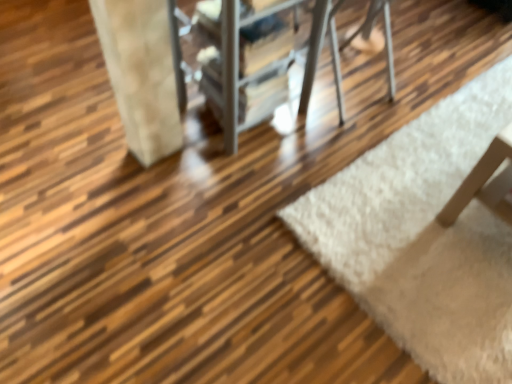
What do you see at coordinates (138, 70) in the screenshot? The width and height of the screenshot is (512, 384). I see `metallic silver chair at center` at bounding box center [138, 70].

This screenshot has width=512, height=384. I want to click on metallic silver chair at center, so click(138, 70).

Measure the distance between point (127, 116) and camera.

Point (127, 116) and camera are 4.72 feet apart.

Image resolution: width=512 pixels, height=384 pixels. I want to click on white fluffy rug at lower right, so click(424, 236).

Describe the element at coordinates (424, 236) in the screenshot. The height and width of the screenshot is (384, 512). I see `white fluffy rug at lower right` at that location.

What is the approximate width of white fluffy rug at lower right?

It is 1.62 meters.

Locate an element on the screen. This screenshot has height=384, width=512. metallic silver chair at center is located at coordinates (138, 70).

Is white fluffy rug at lower right to the right of metallic silver chair at center from the viewer's perspective?

Yes.

Who is more distant, white fluffy rug at lower right or metallic silver chair at center?

white fluffy rug at lower right is behind.

Is point (353, 285) farther from camera compared to point (114, 54)?

Yes, it is.

From the image's perspective, is white fluffy rug at lower right located beneath metallic silver chair at center?

Yes.

From a real-world perspective, who is located lower, white fluffy rug at lower right or metallic silver chair at center?

white fluffy rug at lower right, from a real-world perspective.

Which object is wider, white fluffy rug at lower right or metallic silver chair at center?

white fluffy rug at lower right is wider.

Considering the sizes of objects white fluffy rug at lower right and metallic silver chair at center in the image provided, who is taller, white fluffy rug at lower right or metallic silver chair at center?

With more height is metallic silver chair at center.

From the picture: Considering the sizes of white fluffy rug at lower right and metallic silver chair at center in the image, is white fluffy rug at lower right bigger or smaller than metallic silver chair at center?

Considering their sizes, white fluffy rug at lower right takes up less space than metallic silver chair at center.

Can metallic silver chair at center be found inside white fluffy rug at lower right?

Definitely not — metallic silver chair at center is not inside white fluffy rug at lower right.

Is white fluffy rug at lower right next to metallic silver chair at center and touching it?

No.

Could you tell me if white fluffy rug at lower right is turned towards metallic silver chair at center?

No, white fluffy rug at lower right is not aimed at metallic silver chair at center.

There is a white fluffy rug at lower right. Identify the location of furniture above it (from a real-world perspective). (138, 70).

In the image, is metallic silver chair at center on the left side or the right side of white fluffy rug at lower right?

metallic silver chair at center is to the left of white fluffy rug at lower right.

Relative to white fluffy rug at lower right, is metallic silver chair at center in front or behind?

metallic silver chair at center is positioned closer to the viewer than white fluffy rug at lower right.

Is point (106, 60) farther from camera compared to point (394, 333)?

That is True.

From the image's perspective, which object appears higher, metallic silver chair at center or white fluffy rug at lower right?

From the image's view, metallic silver chair at center is above.

Based on the photo, from a real-world perspective, is metallic silver chair at center positioned above or below white fluffy rug at lower right?

metallic silver chair at center is above white fluffy rug at lower right.

Considering the sizes of objects metallic silver chair at center and white fluffy rug at lower right in the image provided, who is wider, metallic silver chair at center or white fluffy rug at lower right?

With larger width is white fluffy rug at lower right.

Based on the photo, can you confirm if metallic silver chair at center is shorter than white fluffy rug at lower right?

No, metallic silver chair at center is not shorter than white fluffy rug at lower right.

Considering the relative sizes of metallic silver chair at center and white fluffy rug at lower right in the image provided, is metallic silver chair at center bigger than white fluffy rug at lower right?

Indeed, metallic silver chair at center has a larger size compared to white fluffy rug at lower right.

Is metallic silver chair at center not inside white fluffy rug at lower right?

metallic silver chair at center is positioned outside white fluffy rug at lower right.

Is metallic silver chair at center not near white fluffy rug at lower right?

That's not correct — metallic silver chair at center is a little close to white fluffy rug at lower right.

Does metallic silver chair at center turn towards white fluffy rug at lower right?

Yes, metallic silver chair at center is oriented towards white fluffy rug at lower right.

Can you tell me how much metallic silver chair at center and white fluffy rug at lower right differ in facing direction?

90 degrees separate the facing orientations of metallic silver chair at center and white fluffy rug at lower right.

At what (x,y) coordinates should I click in order to perform the action: click on furniture lying above the white fluffy rug at lower right (from the image's perspective). Please return your answer as a coordinate pair (x, y). Looking at the image, I should click on (138, 70).

This screenshot has height=384, width=512. I want to click on mat beneath the metallic silver chair at center (from a real-world perspective), so click(x=424, y=236).

Locate an element on the screen. furniture lying above the white fluffy rug at lower right (from the image's perspective) is located at coordinates (138, 70).